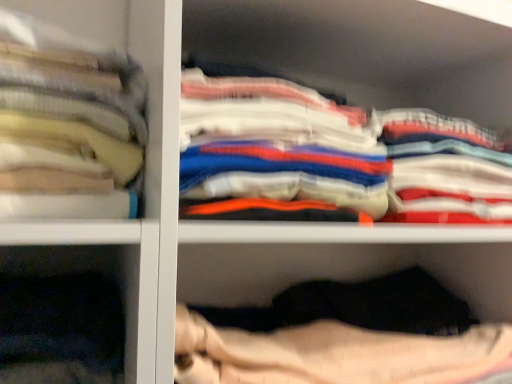
Question: Is white cotton shirts at upper right, the 1th clothing when ordered from right to left, a part of white cotton shirts at center, the second clothing viewed from the left?

Choices:
 (A) no
 (B) yes

Answer: (A)

Question: Is white cotton shirts at center, the second clothing viewed from the left, aimed at white cotton shirts at upper right, the 1th clothing when ordered from right to left?

Choices:
 (A) no
 (B) yes

Answer: (A)

Question: Is white cotton shirts at center, placed as the second clothing when sorted from right to left, oriented away from white cotton shirts at upper right, the 3th clothing in the left-to-right sequence?

Choices:
 (A) yes
 (B) no

Answer: (B)

Question: Would you consider white cotton shirts at center, the second clothing viewed from the left, to be distant from white cotton shirts at upper right, the 3th clothing in the left-to-right sequence?

Choices:
 (A) yes
 (B) no

Answer: (B)

Question: Is the position of white cotton shirts at center, the second clothing viewed from the left, more distant than that of white cotton shirts at upper right, the 1th clothing when ordered from right to left?

Choices:
 (A) no
 (B) yes

Answer: (A)

Question: From their relative heights in the image, would you say white cotton shirts at center, placed as the second clothing when sorted from right to left, is taller or shorter than white cotton shirts at upper right, the 1th clothing when ordered from right to left?

Choices:
 (A) tall
 (B) short

Answer: (A)

Question: In terms of size, does white cotton shirts at center, the second clothing viewed from the left, appear bigger or smaller than white cotton shirts at upper right, the 1th clothing when ordered from right to left?

Choices:
 (A) big
 (B) small

Answer: (A)

Question: From the image's perspective, is white cotton shirts at center, placed as the second clothing when sorted from right to left, above or below white cotton shirts at upper right, the 3th clothing in the left-to-right sequence?

Choices:
 (A) below
 (B) above

Answer: (B)

Question: Does point pos(347,117) appear closer or farther from the camera than point pos(433,142)?

Choices:
 (A) farther
 (B) closer

Answer: (B)

Question: In terms of width, does white cotton shirts at upper right, the 3th clothing in the left-to-right sequence, look wider or thinner when compared to soft cotton towels at left, which appears as the 1th clothing when viewed from the left?

Choices:
 (A) thin
 (B) wide

Answer: (B)

Question: From the image's perspective, is white cotton shirts at upper right, the 3th clothing in the left-to-right sequence, above or below soft cotton towels at left, which appears as the 1th clothing when viewed from the left?

Choices:
 (A) above
 (B) below

Answer: (B)

Question: From a real-world perspective, is white cotton shirts at upper right, the 1th clothing when ordered from right to left, positioned above or below soft cotton towels at left, arranged as the third clothing when viewed from the right?

Choices:
 (A) below
 (B) above

Answer: (A)

Question: Visually, is white cotton shirts at upper right, the 1th clothing when ordered from right to left, positioned to the left or to the right of soft cotton towels at left, which appears as the 1th clothing when viewed from the left?

Choices:
 (A) right
 (B) left

Answer: (A)

Question: Looking at their shapes, would you say white cotton shirts at center, placed as the second clothing when sorted from right to left, is wider or thinner than soft cotton towels at left, which appears as the 1th clothing when viewed from the left?

Choices:
 (A) thin
 (B) wide

Answer: (B)

Question: Is point (181, 140) positioned closer to the camera than point (61, 198)?

Choices:
 (A) closer
 (B) farther

Answer: (B)